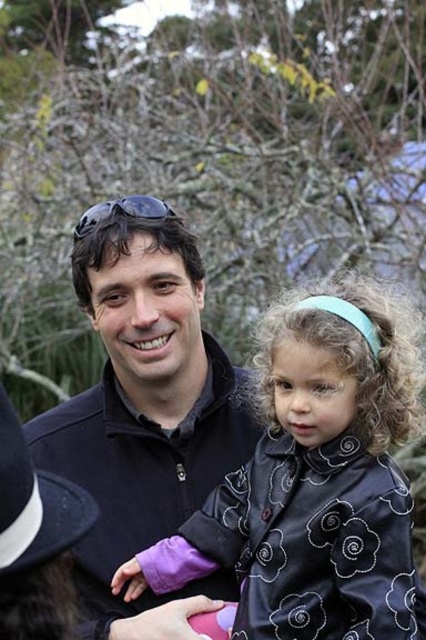
You are a photographer trying to adjust the lighting for a photo shoot. You notice two black jackets in the scene. The first is a black satin coat at center, and the second is a matte black jacket at center. Which one is positioned lower in the image?

The black satin coat at center is located below the matte black jacket at center, so it is positioned lower in the image.

You are a fashion designer observing the two black coats in the image. Which one is shorter in height between the black satin coat at center and the matte black jacket at center?

The black satin coat at center is shorter in height than the matte black jacket at center.

You are a fashion designer observing two coats in the image. The black satin coat at center and the matte black jacket at center. Which one has a larger size?

The black satin coat at center is bigger than the matte black jacket at center, so the black satin coat at center has a larger size.